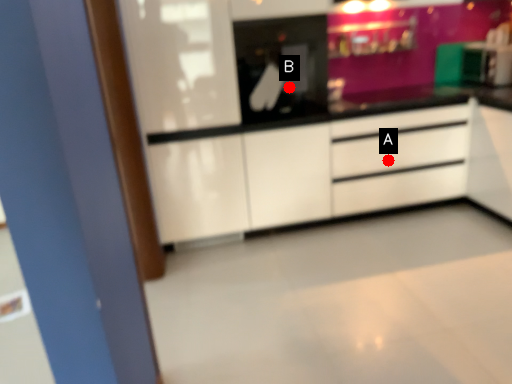
Question: Two points are circled on the image, labeled by A and B beside each circle. Which point is closer to the camera taking this photo?

Choices:
 (A) A is closer
 (B) B is closer

Answer: (B)